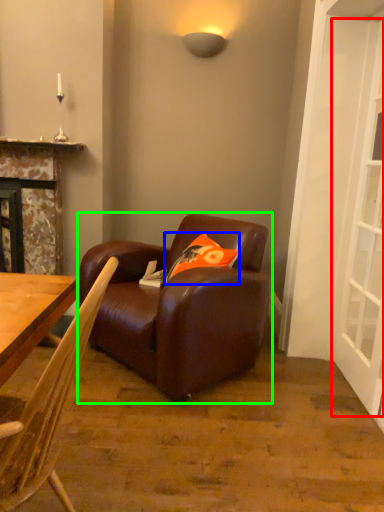
Question: Which object is the closest to the screen door (highlighted by a red box)? Choose among these: pillow (highlighted by a blue box) or studio couch (highlighted by a green box).

Choices:
 (A) pillow
 (B) studio couch

Answer: (A)